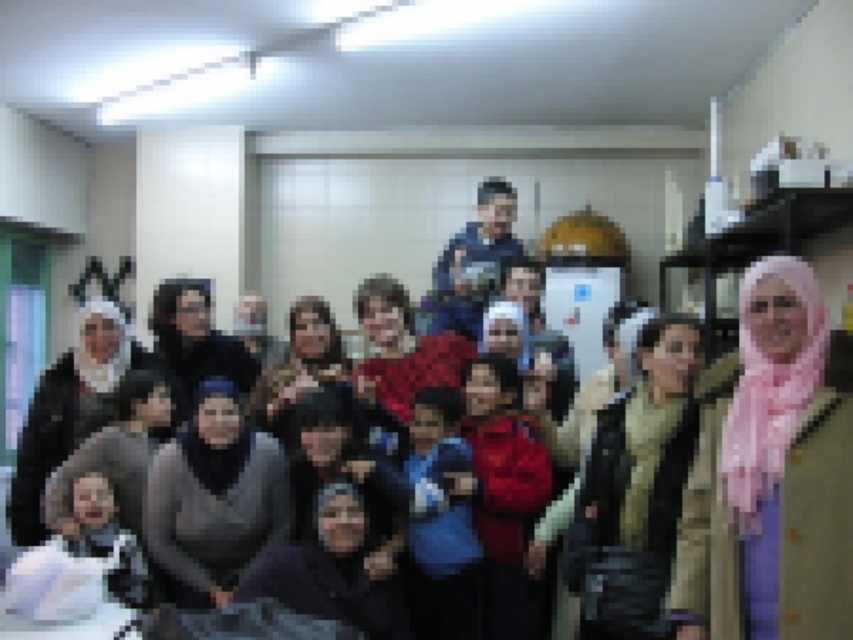
In the scene shown: What is located at the point with coordinates (787, 460) in the image?

The pink fabric hijab at center is located at point (787, 460).

You are a photographer standing at the back of the room. You want to take a photo that includes both the pink fabric hijab at center and the gray matte hijab at center. Considering their positions, can you fit both into your camera frame without moving closer or farther away?

The pink fabric hijab at center is 1.80 meters away from the gray matte hijab at center. Since the distance between them is 1.80 meters, if your camera frame can accommodate that width, you can include both in the photo without moving.